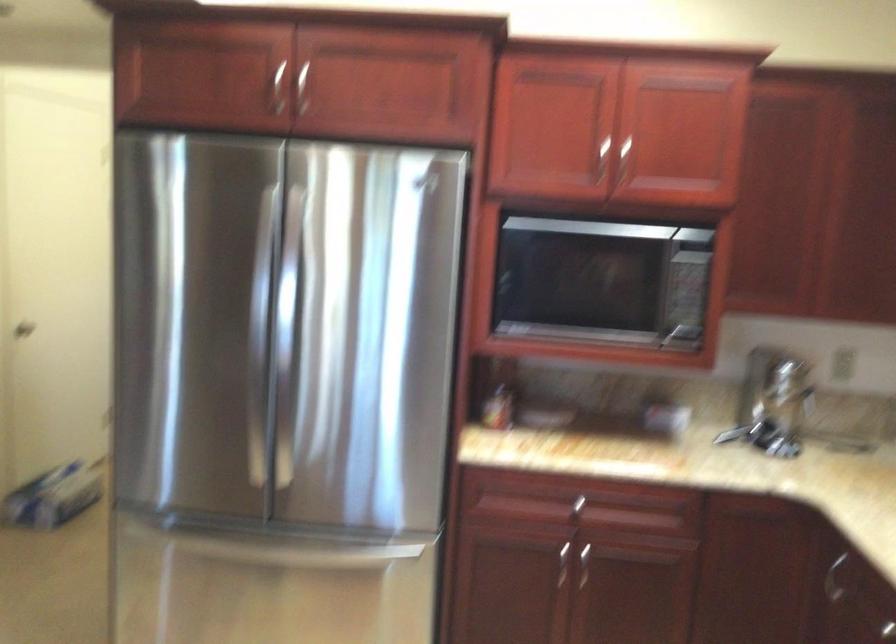
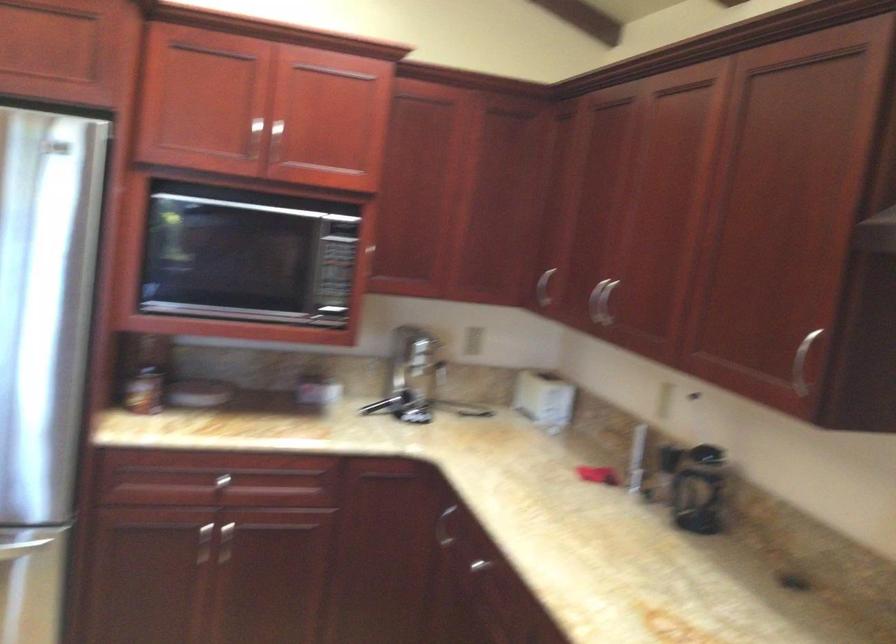
The point at (558,571) is marked in the first image. Where is the corresponding point in the second image?

(203, 544)